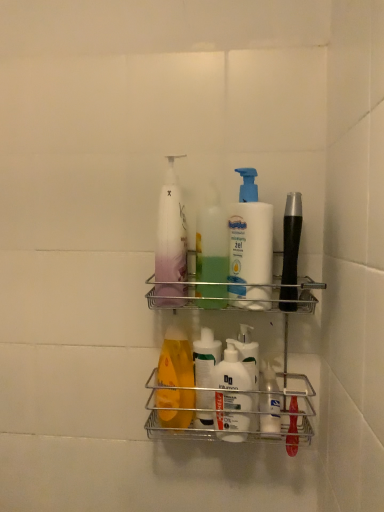
Question: Considering their positions, is white matte lotion at center, the 1th cleaning product in the right-to-left sequence, located in front of or behind translucent plastic bottle at center, the second cleaning product in the left-to-right sequence?

Choices:
 (A) behind
 (B) front

Answer: (B)

Question: Based on their positions, is white matte lotion at center, the 1th cleaning product in the right-to-left sequence, located to the left or right of translucent plastic bottle at center, positioned as the second cleaning product in right-to-left order?

Choices:
 (A) right
 (B) left

Answer: (A)

Question: Which object is positioned closest to the white matte lotion at center, the 1th cleaning product in the right-to-left sequence?

Choices:
 (A) translucent plastic pump bottle at center, which is the third cleaning product from right to left
 (B) translucent plastic bottle at center, positioned as the second cleaning product in right-to-left order
 (C) metallic silver shelf at center

Answer: (B)

Question: Which object is the closest to the translucent plastic pump bottle at center, which is the first cleaning product in left-to-right order?

Choices:
 (A) metallic silver shelf at center
 (B) translucent plastic bottle at center, positioned as the second cleaning product in right-to-left order
 (C) white matte lotion at center, the 1th cleaning product in the right-to-left sequence

Answer: (B)